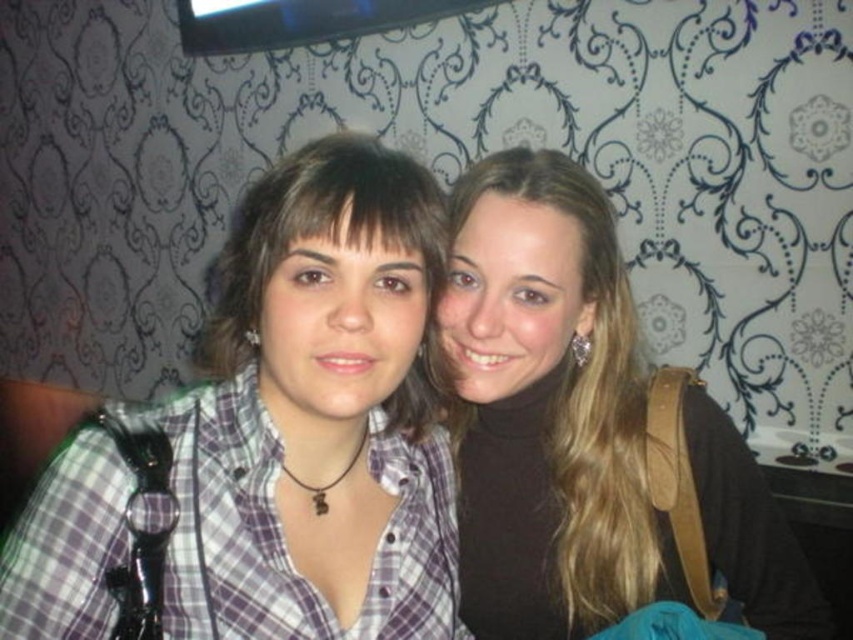
Question: Does plaid shirt at center appear under smooth brown hair at center?

Choices:
 (A) no
 (B) yes

Answer: (A)

Question: Can you confirm if plaid shirt at center is smaller than smooth brown hair at center?

Choices:
 (A) yes
 (B) no

Answer: (B)

Question: Which of the following is the closest to the observer?

Choices:
 (A) plaid shirt at center
 (B) smooth brown hair at center

Answer: (A)

Question: Observing the image, what is the correct spatial positioning of plaid shirt at center in reference to smooth brown hair at center?

Choices:
 (A) left
 (B) right

Answer: (A)